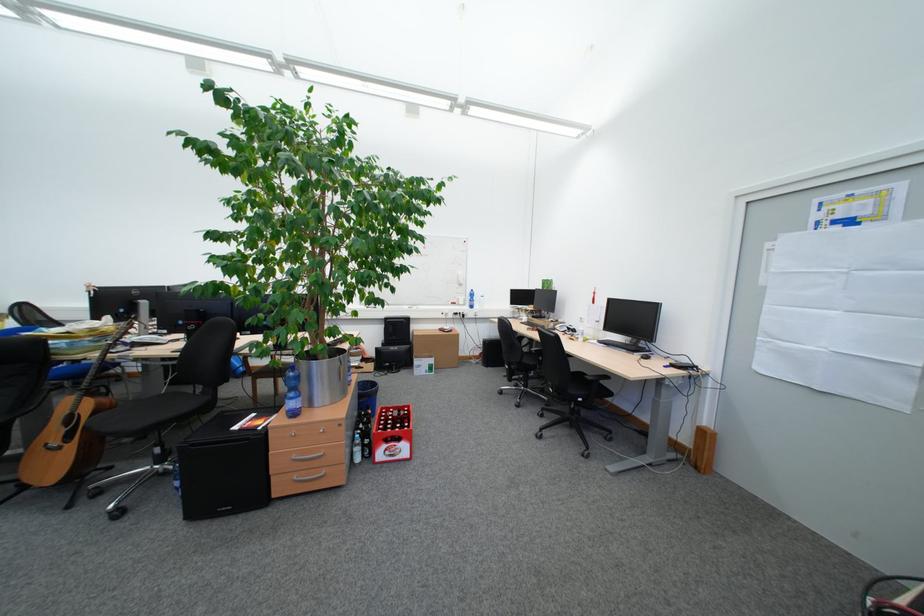
Find the location of a particular element. brown beer bottle is located at coordinates 386,424.